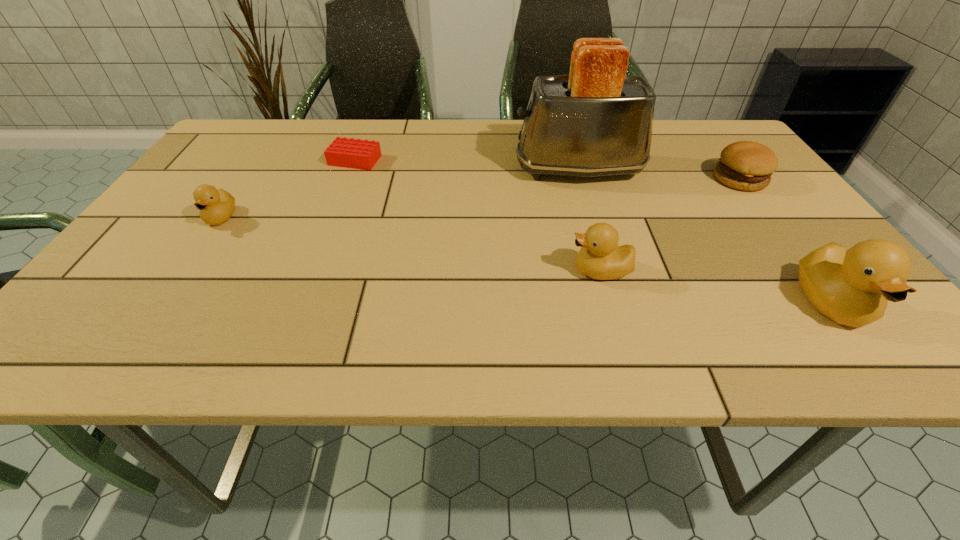
To ensure equal spacing by inserting another duckling among them, please point out a vacant spot for this new duckling. Please provide its 2D coordinates. Your answer should be formatted as a tuple, i.e. [(x, y)], where the tuple contains the x and y coordinates of a point satisfying the conditions above.

[(398, 242)]